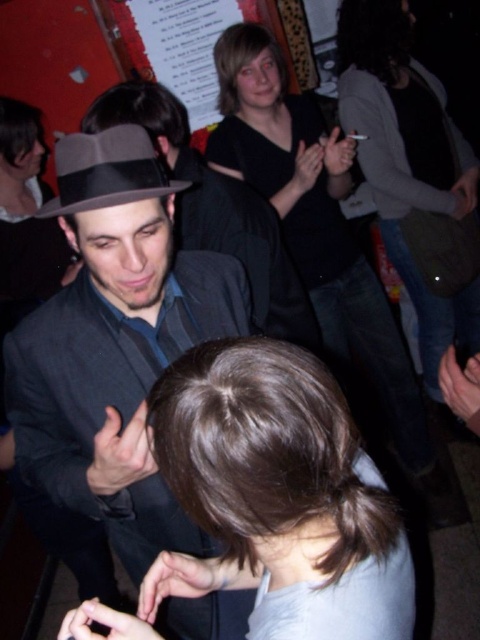
You are a fashion designer observing a man at a party wearing a matte black suit at center and a black matte shirt at center. Which clothing item has a shorter vertical length?

The matte black suit at center has a lesser height compared to the black matte shirt at center, so the matte black suit at center is shorter vertically.

You are a fashion designer observing the man at the event. You need to determine which item of clothing is narrower between the matte black suit at center and the black matte shirt at center. Which one is it?

The matte black suit at center is thinner than the black matte shirt at center, so the matte black suit at center is narrower.